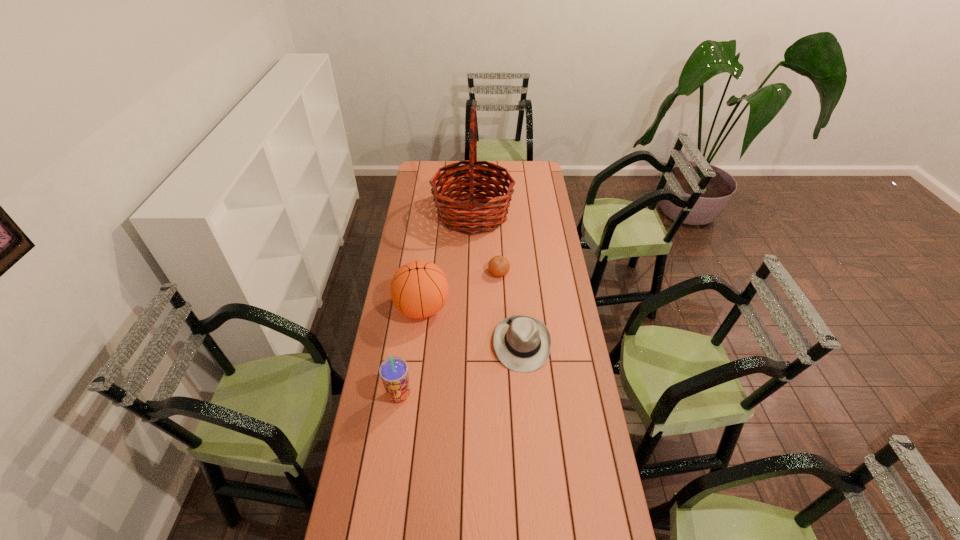
Image resolution: width=960 pixels, height=540 pixels. Find the location of `vacant space in between the nearest object and the basketball`. vacant space in between the nearest object and the basketball is located at coordinates (411, 352).

At what (x,y) coordinates should I click in order to perform the action: click on free spot between the tallest object and the clementine. Please return your answer as a coordinate pair (x, y). Image resolution: width=960 pixels, height=540 pixels. Looking at the image, I should click on (486, 244).

Identify the location of empty location between the clementine and the fourth tallest object. The width and height of the screenshot is (960, 540). (511, 308).

I want to click on free space between the smoothie and the shortest object, so click(449, 334).

In order to click on vacant space that's between the farthest object and the basketball in this screenshot , I will do `click(447, 261)`.

Find the location of a particular element. The image size is (960, 540). free spot between the second shortest object and the basketball is located at coordinates (472, 326).

At what (x,y) coordinates should I click in order to perform the action: click on object that is the second closest to the smoothie. Please return your answer as a coordinate pair (x, y). Looking at the image, I should click on (522, 343).

The width and height of the screenshot is (960, 540). Find the location of `the closest object relative to the fourth tallest object`. the closest object relative to the fourth tallest object is located at coordinates (419, 289).